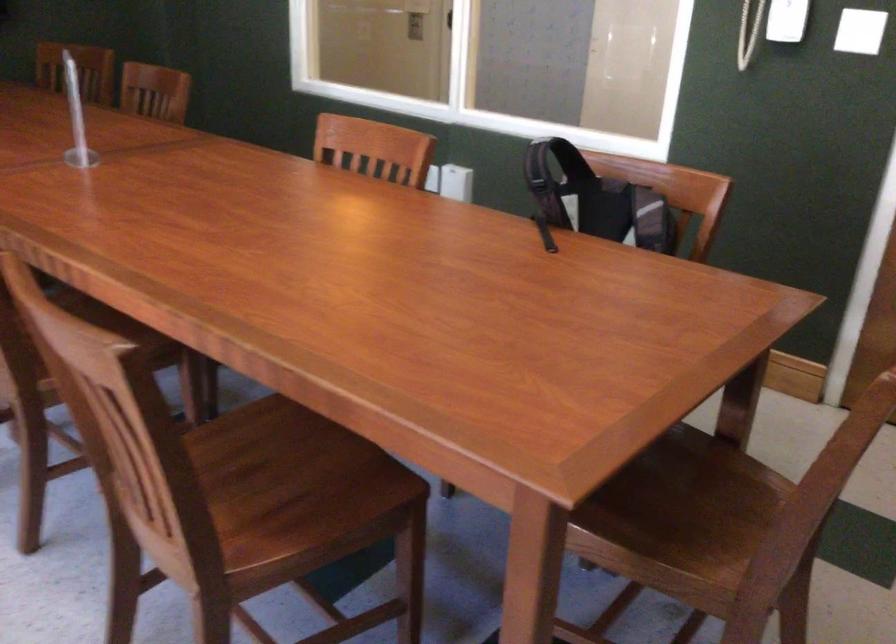
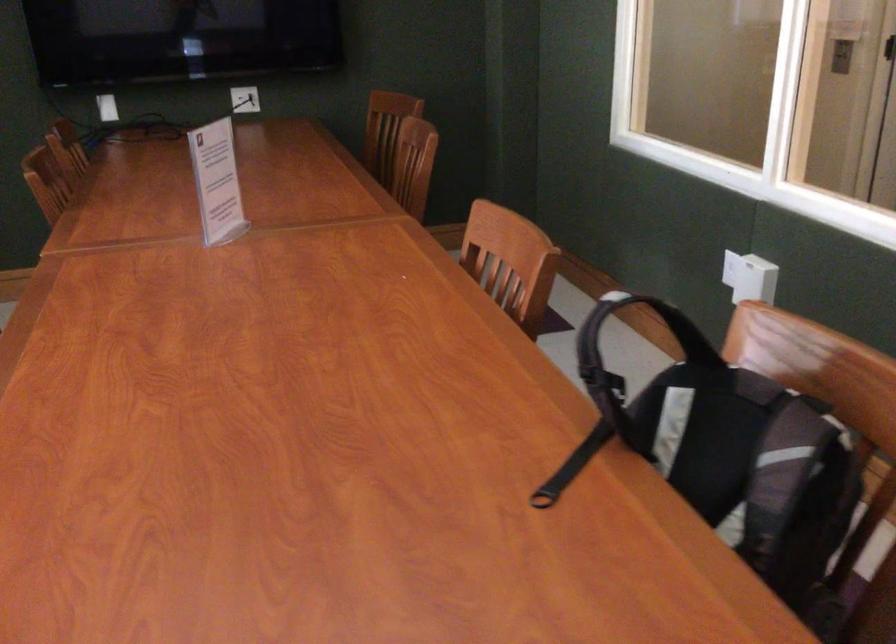
Find the pixel in the second image that matches point (655, 205) in the first image.

(796, 456)